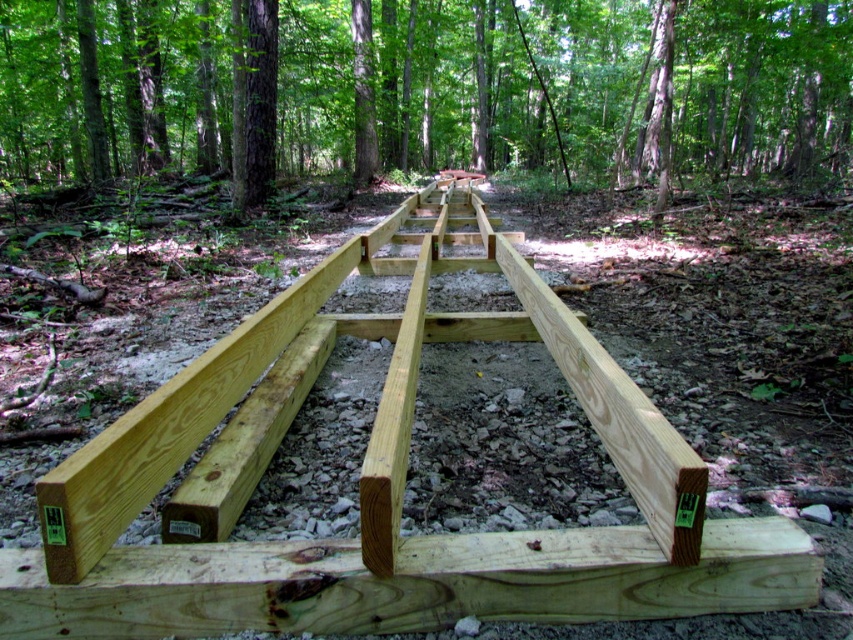
You are a construction worker at the site and need to access the natural wood rail at center to check its alignment. The green wood planks at center are blocking your path. Can you walk around them to reach the rail?

The natural wood rail at center is behind the green wood planks at center, so you can walk around the green wood planks at center to access the natural wood rail at center from the front or sides.

You are a construction worker trying to decide which material to use for a new project. You have two options in front of you at the construction site in the forested area. The green wood planks at center and the natural wood rail at center. Which one has a greater width?

The green wood planks at center might be wider than natural wood rail at center according to the description provided.